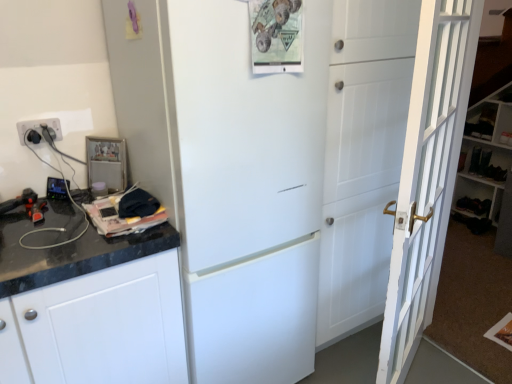
Question: From the image's perspective, relative to white wooden bookshelf at right, is white wooden door at right above or below?

Choices:
 (A) below
 (B) above

Answer: (A)

Question: In the image, is white wooden door at right on the left side or the right side of white wooden bookshelf at right?

Choices:
 (A) left
 (B) right

Answer: (A)

Question: Which object is positioned farthest from the metallic photo frame at upper left?

Choices:
 (A) white plastic electrical outlet at left
 (B) white matte refrigerator at center
 (C) white wooden bookshelf at right
 (D) white wooden door at right

Answer: (C)

Question: Estimate the real-world distances between objects in this image. Which object is farther from the metallic photo frame at upper left?

Choices:
 (A) white wooden door at right
 (B) white matte refrigerator at center
 (C) white plastic electrical outlet at left
 (D) white wooden bookshelf at right

Answer: (D)